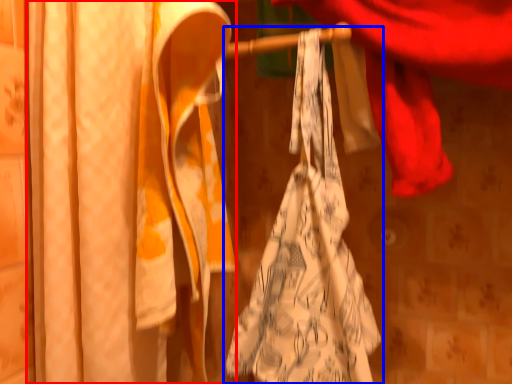
Question: Which object appears farthest to the camera in this image, curtain (highlighted by a red box) or towel (highlighted by a blue box)?

Choices:
 (A) curtain
 (B) towel

Answer: (B)